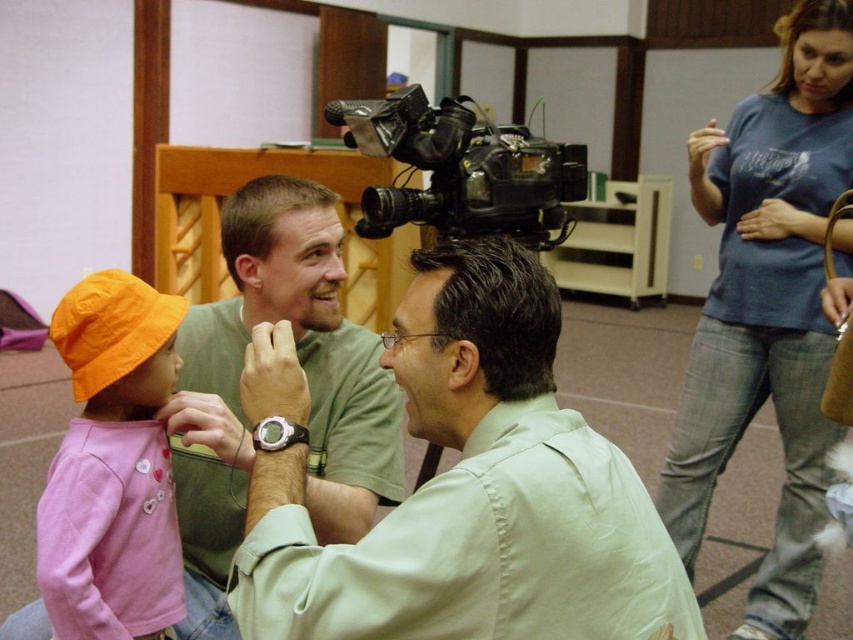
Question: Which point is farther from the camera taking this photo?

Choices:
 (A) (703, 179)
 (B) (457, 225)
 (C) (376, 545)

Answer: (B)

Question: Which is farther from the blue cotton shirt at upper right?

Choices:
 (A) black plastic video camera at upper center
 (B) orange cotton hat at lower left
 (C) light green shirt at center
 (D) matte green shirt at center

Answer: (B)

Question: Does orange cotton hat at lower left appear under black plastic video camera at upper center?

Choices:
 (A) yes
 (B) no

Answer: (A)

Question: Among these points, which one is farthest from the camera?

Choices:
 (A) (524, 572)
 (B) (524, 230)
 (C) (279, 177)

Answer: (B)

Question: Is blue cotton shirt at upper right positioned at the back of orange cotton hat at lower left?

Choices:
 (A) yes
 (B) no

Answer: (A)

Question: Is blue cotton shirt at upper right below orange cotton hat at lower left?

Choices:
 (A) yes
 (B) no

Answer: (B)